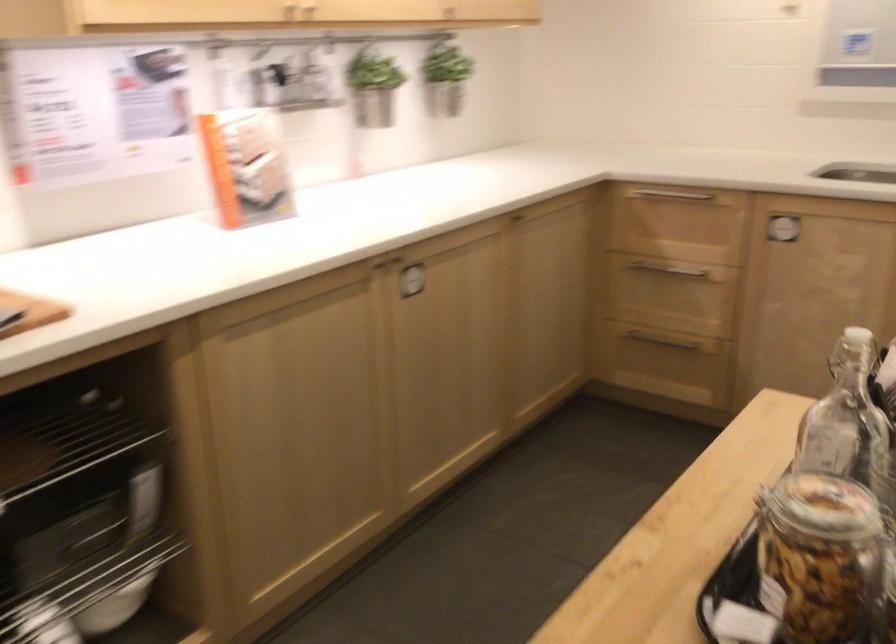
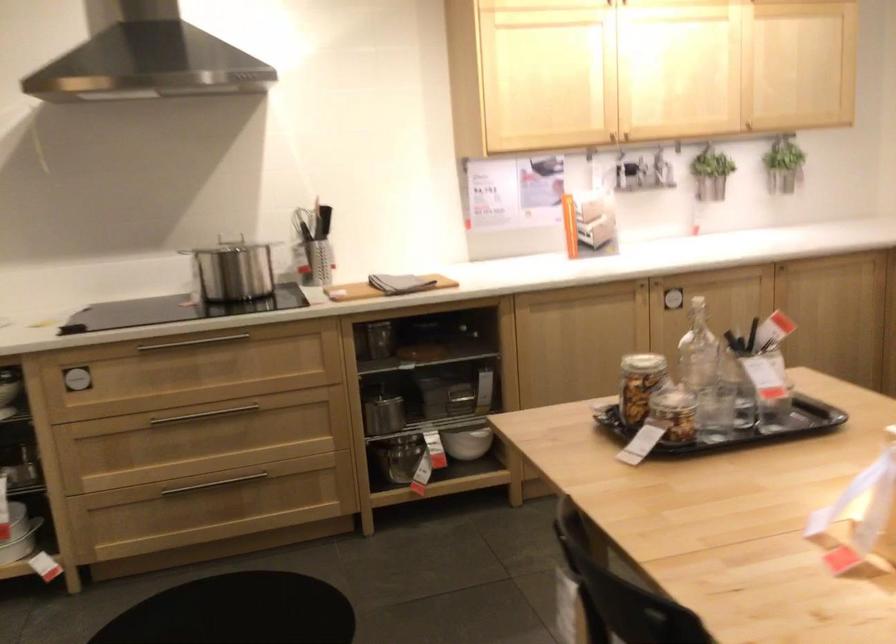
Where in the second image is the point corresponding to point (771, 571) from the first image?

(640, 384)